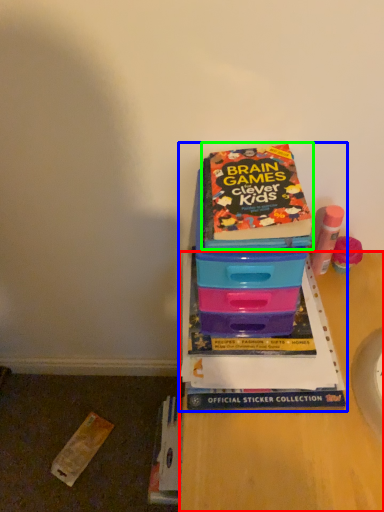
Question: Based on their relative distances, which object is nearer to desk (highlighted by a red box)? Choose from book (highlighted by a blue box) and book (highlighted by a green box).

Choices:
 (A) book
 (B) book

Answer: (A)